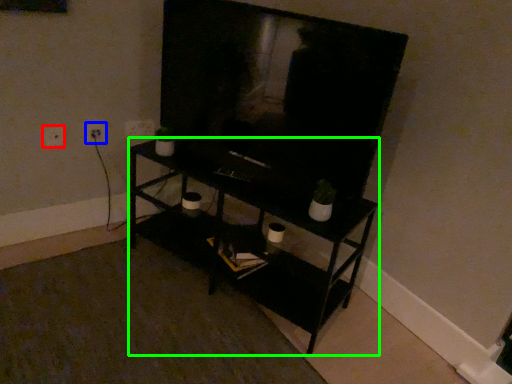
Question: Which is farther away from electric outlet (highlighted by a red box)? electric outlet (highlighted by a blue box) or shelf (highlighted by a green box)?

Choices:
 (A) electric outlet
 (B) shelf

Answer: (B)